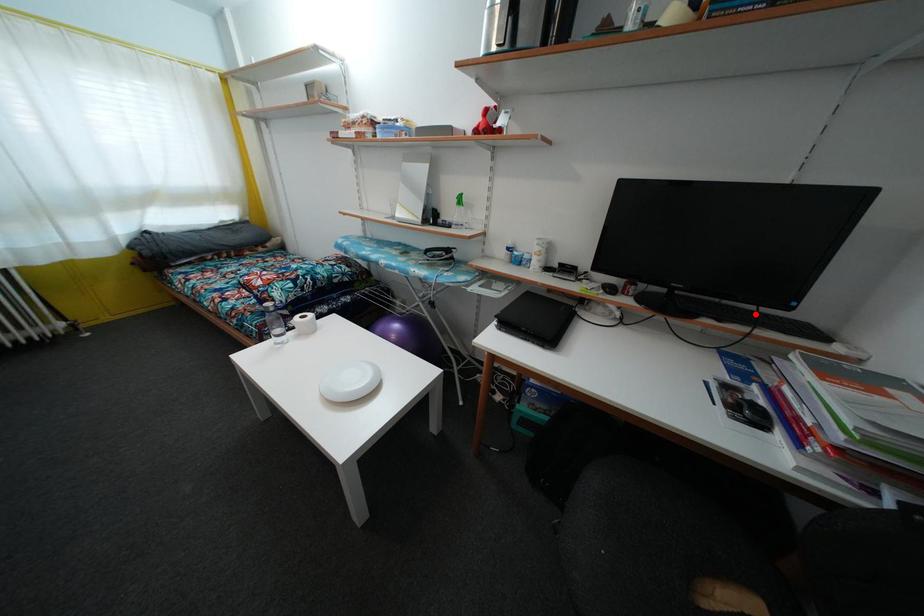
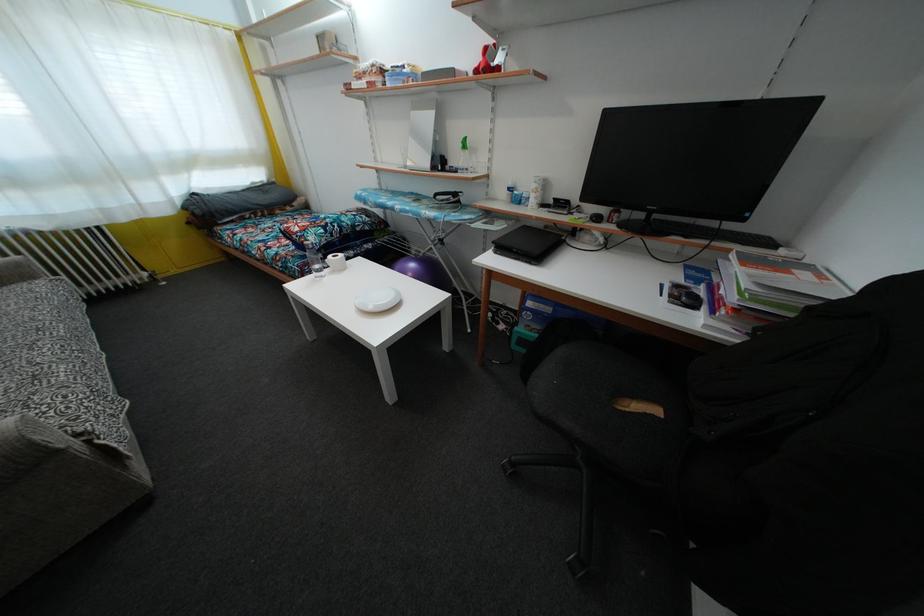
In the second image, find the point that corresponds to the highlighted location in the first image.

(719, 230)